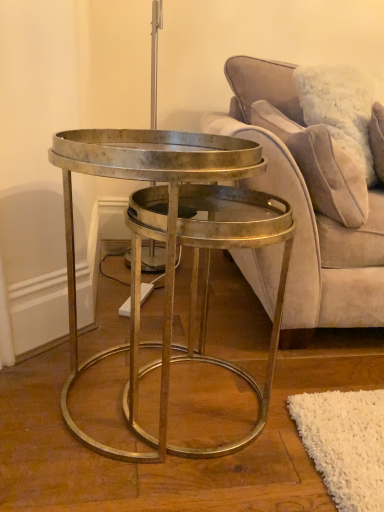
Question: From a real-world perspective, is velvet beige pillow at upper right under velvet beige couch at center?

Choices:
 (A) yes
 (B) no

Answer: (B)

Question: Is velvet beige pillow at upper right to the left of velvet beige couch at center from the viewer's perspective?

Choices:
 (A) yes
 (B) no

Answer: (A)

Question: Can you confirm if velvet beige pillow at upper right is wider than velvet beige couch at center?

Choices:
 (A) no
 (B) yes

Answer: (A)

Question: From the image's perspective, is velvet beige pillow at upper right above velvet beige couch at center?

Choices:
 (A) no
 (B) yes

Answer: (B)

Question: Is velvet beige pillow at upper right further to camera compared to velvet beige couch at center?

Choices:
 (A) yes
 (B) no

Answer: (A)

Question: Is velvet beige pillow at upper right looking in the opposite direction of velvet beige couch at center?

Choices:
 (A) yes
 (B) no

Answer: (A)

Question: Considering the relative sizes of metallic gold coffee table at center and velvet beige couch at center in the image provided, is metallic gold coffee table at center shorter than velvet beige couch at center?

Choices:
 (A) yes
 (B) no

Answer: (A)

Question: Is metallic gold coffee table at center not within velvet beige couch at center?

Choices:
 (A) yes
 (B) no

Answer: (A)

Question: Does metallic gold coffee table at center have a larger size compared to velvet beige couch at center?

Choices:
 (A) yes
 (B) no

Answer: (B)

Question: Is metallic gold coffee table at center positioned with its back to velvet beige couch at center?

Choices:
 (A) yes
 (B) no

Answer: (B)

Question: Is metallic gold coffee table at center at the right side of velvet beige couch at center?

Choices:
 (A) no
 (B) yes

Answer: (A)

Question: Is metallic gold coffee table at center taller than velvet beige couch at center?

Choices:
 (A) yes
 (B) no

Answer: (B)

Question: Considering the relative positions of velvet beige couch at center and metallic gold coffee table at center in the image provided, is velvet beige couch at center to the left of metallic gold coffee table at center from the viewer's perspective?

Choices:
 (A) no
 (B) yes

Answer: (A)